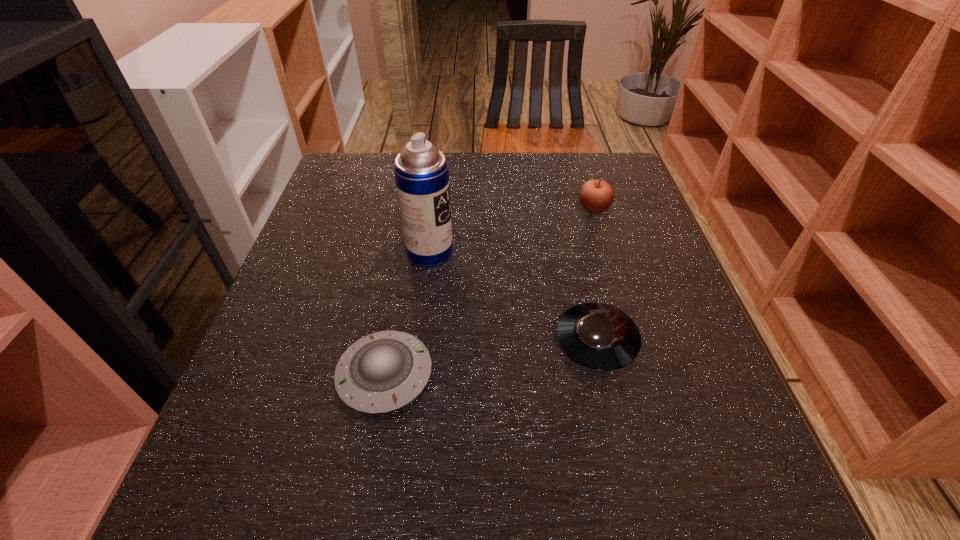
Find the location of a particular element. The height and width of the screenshot is (540, 960). vacant space in between the right saucer and the tallest object is located at coordinates (513, 297).

Find the location of a particular element. The width and height of the screenshot is (960, 540). free space between the left saucer and the third nearest object is located at coordinates (407, 314).

You are a GUI agent. You are given a task and a screenshot of the screen. Output one action in this format:
    pyautogui.click(x=<x>, y=<y>)
    Task: Click on the free spot between the right saucer and the shortest object
    Image resolution: width=960 pixels, height=540 pixels.
    Given the screenshot: What is the action you would take?
    pyautogui.click(x=491, y=359)

Image resolution: width=960 pixels, height=540 pixels. Find the location of `free space between the right saucer and the aerosol can`. free space between the right saucer and the aerosol can is located at coordinates (513, 297).

I want to click on vacant space that is in between the left saucer and the second tallest object, so click(490, 292).

Locate an element on the screen. vacant area between the right saucer and the tallest object is located at coordinates click(513, 297).

I want to click on free spot between the right saucer and the left saucer, so click(x=491, y=359).

Where is `empty location between the apple and the tallest object`? empty location between the apple and the tallest object is located at coordinates (512, 231).

Locate an element on the screen. The height and width of the screenshot is (540, 960). empty space that is in between the aerosol can and the shortest object is located at coordinates (407, 314).

Where is `blank region between the right saucer and the aerosol can`? The height and width of the screenshot is (540, 960). blank region between the right saucer and the aerosol can is located at coordinates (513, 297).